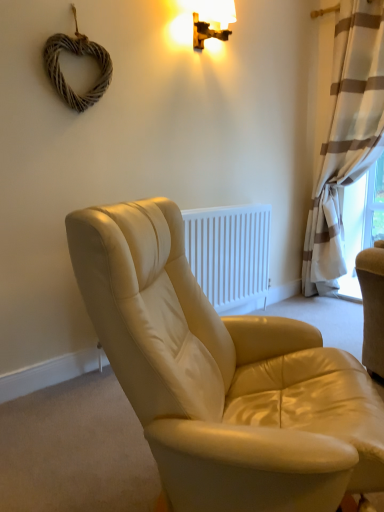
The width and height of the screenshot is (384, 512). What do you see at coordinates (210, 19) in the screenshot? I see `wooden wall sconce at upper center` at bounding box center [210, 19].

Image resolution: width=384 pixels, height=512 pixels. What do you see at coordinates (76, 55) in the screenshot? I see `woven wood heart at upper left` at bounding box center [76, 55].

This screenshot has height=512, width=384. In order to click on wooden wall sconce at upper center in this screenshot , I will do `click(210, 19)`.

Considering the positions of objects white striped curtain at right and wooden wall sconce at upper center in the image provided, who is more to the left, white striped curtain at right or wooden wall sconce at upper center?

wooden wall sconce at upper center.

Is white striped curtain at right shorter than wooden wall sconce at upper center?

No.

Locate an element on the screen. curtain lying on the right of wooden wall sconce at upper center is located at coordinates (346, 137).

Does white striped curtain at right touch wooden wall sconce at upper center?

No, white striped curtain at right is not in contact with wooden wall sconce at upper center.

Looking at this image, is wooden wall sconce at upper center facing away from leather chair at center?

No.

Is wooden wall sconce at upper center spatially inside leather chair at center, or outside of it?

wooden wall sconce at upper center is not enclosed by leather chair at center.

Which of these two, wooden wall sconce at upper center or leather chair at center, stands shorter?

leather chair at center.

Where is `studio couch located underneath the wooden wall sconce at upper center (from a real-world perspective)`? studio couch located underneath the wooden wall sconce at upper center (from a real-world perspective) is located at coordinates (222, 376).

Is wooden wall sconce at upper center turned away from white striped curtain at right?

wooden wall sconce at upper center does not have its back to white striped curtain at right.

From the image's perspective, is wooden wall sconce at upper center above or below white striped curtain at right?

Based on their image positions, wooden wall sconce at upper center is located above white striped curtain at right.

Does point (192, 2) lie in front of point (364, 155)?

Yes, it is in front of point (364, 155).

From a real-world perspective, is woven wood heart at upper left under white striped curtain at right?

No, from a real-world perspective, woven wood heart at upper left is not below white striped curtain at right.

Consider the image. How different are the orientations of woven wood heart at upper left and white striped curtain at right in degrees?

There is a 90-degree angle between the facing directions of woven wood heart at upper left and white striped curtain at right.

Is the surface of woven wood heart at upper left in direct contact with white striped curtain at right?

No.

From a real-world perspective, between leather chair at center and wooden wall sconce at upper center, who is vertically higher?

From a 3D spatial view, wooden wall sconce at upper center is above.

From the image's perspective, is leather chair at center on top of wooden wall sconce at upper center?

No, from the image's perspective, leather chair at center is not over wooden wall sconce at upper center.

This screenshot has width=384, height=512. I want to click on lamp that appears above the leather chair at center (from the image's perspective), so click(x=210, y=19).

Is woven wood heart at upper left looking in the opposite direction of wooden wall sconce at upper center?

No, woven wood heart at upper left is not facing away from wooden wall sconce at upper center.

Considering their positions, is woven wood heart at upper left located in front of or behind wooden wall sconce at upper center?

Visually, woven wood heart at upper left is located in front of wooden wall sconce at upper center.

Who is smaller, woven wood heart at upper left or wooden wall sconce at upper center?

Smaller between the two is woven wood heart at upper left.

How many degrees apart are the facing directions of white striped curtain at right and woven wood heart at upper left?

90 degrees.

Based on the photo, who is shorter, white striped curtain at right or woven wood heart at upper left?

With less height is woven wood heart at upper left.

Relative to woven wood heart at upper left, is white striped curtain at right in front or behind?

white striped curtain at right is positioned farther from the viewer than woven wood heart at upper left.

From a real-world perspective, is white striped curtain at right positioned over woven wood heart at upper left based on gravity?

Actually, white striped curtain at right is physically below woven wood heart at upper left in the real world.

Where is `curtain located below the wooden wall sconce at upper center (from the image's perspective)`? This screenshot has width=384, height=512. curtain located below the wooden wall sconce at upper center (from the image's perspective) is located at coordinates (346, 137).

Locate an element on the screen. The image size is (384, 512). lamp above the leather chair at center (from the image's perspective) is located at coordinates (210, 19).

When comparing their distances from white striped curtain at right, does leather chair at center or wooden wall sconce at upper center seem further?

leather chair at center lies further to white striped curtain at right than the other object.

Based on their spatial positions, is woven wood heart at upper left or leather chair at center closer to white striped curtain at right?

woven wood heart at upper left is closer to white striped curtain at right.

From the image, which object appears to be farther from wooden wall sconce at upper center, leather chair at center or white striped curtain at right?

leather chair at center lies further to wooden wall sconce at upper center than the other object.

Considering their positions, is leather chair at center positioned closer to woven wood heart at upper left than wooden wall sconce at upper center?

wooden wall sconce at upper center lies closer to woven wood heart at upper left than the other object.

Considering their positions, is woven wood heart at upper left positioned further to leather chair at center than wooden wall sconce at upper center?

wooden wall sconce at upper center is positioned further to the anchor leather chair at center.

From the image, which object appears to be farther from woven wood heart at upper left, wooden wall sconce at upper center or white striped curtain at right?

white striped curtain at right lies further to woven wood heart at upper left than the other object.

From the picture: Based on their spatial positions, is wooden wall sconce at upper center or leather chair at center further from woven wood heart at upper left?

leather chair at center is further to woven wood heart at upper left.

Looking at the image, which one is located further to leather chair at center, wooden wall sconce at upper center or white striped curtain at right?

white striped curtain at right lies further to leather chair at center than the other object.

In order to click on rope that lies between wooden wall sconce at upper center and leather chair at center from top to bottom in this screenshot , I will do `click(76, 55)`.

You are a GUI agent. You are given a task and a screenshot of the screen. Output one action in this format:
    pyautogui.click(x=<x>, y=<y>)
    Task: Click on the lamp located between woven wood heart at upper left and white striped curtain at right in the left-right direction
    This screenshot has width=384, height=512.
    Given the screenshot: What is the action you would take?
    pyautogui.click(x=210, y=19)

Where is `rope positioned between leather chair at center and white striped curtain at right from near to far`? rope positioned between leather chair at center and white striped curtain at right from near to far is located at coordinates (76, 55).

The width and height of the screenshot is (384, 512). In order to click on curtain between wooden wall sconce at upper center and leather chair at center in the up-down direction in this screenshot , I will do `click(346, 137)`.